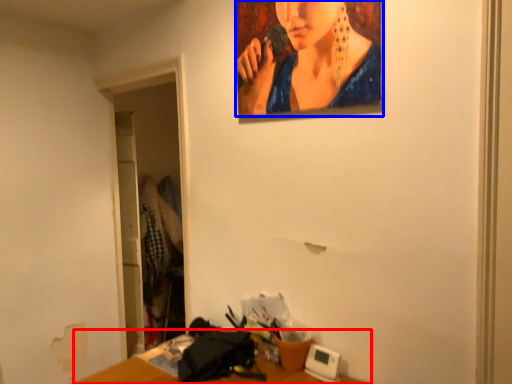
Question: Among these objects, which one is farthest to the camera, table (highlighted by a red box) or person (highlighted by a blue box)?

Choices:
 (A) table
 (B) person

Answer: (B)